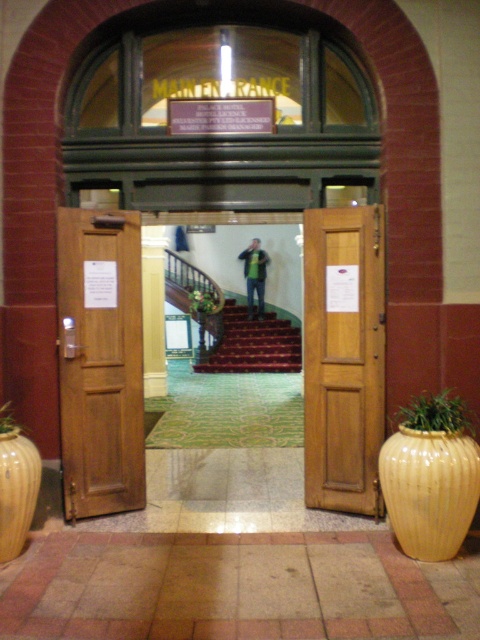
You are an interior designer assessing the entrance of a building. You notice two green items at the center of the entrance area. Which one is taller between the green matte shirt at center and the green leafy plant at center?

The green matte shirt at center is taller than the green leafy plant at center.

You are standing at the main entrance of the building and want to place a small potted plant in the lower right corner of the entrance area. Is there already a green textured plant at lower right in that location?

Yes, there is already a green textured plant at lower right located at point [436,413], so placing another plant there may not be possible.